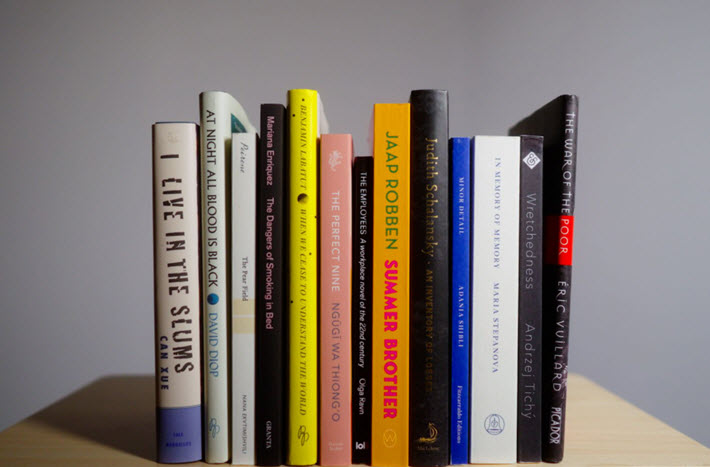
Image resolution: width=710 pixels, height=467 pixels. I want to click on hardback books, so click(163, 270), click(209, 232), click(569, 169), click(427, 155).